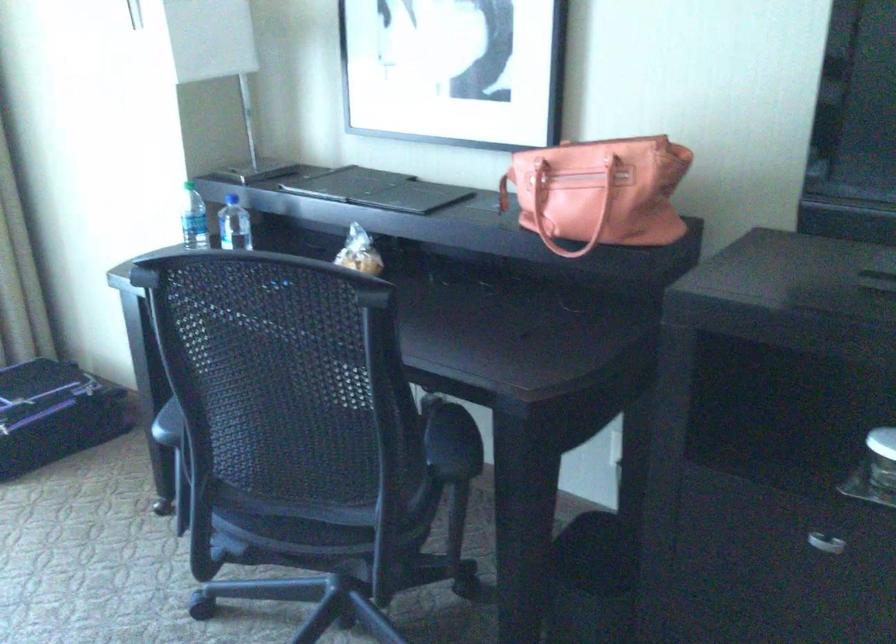
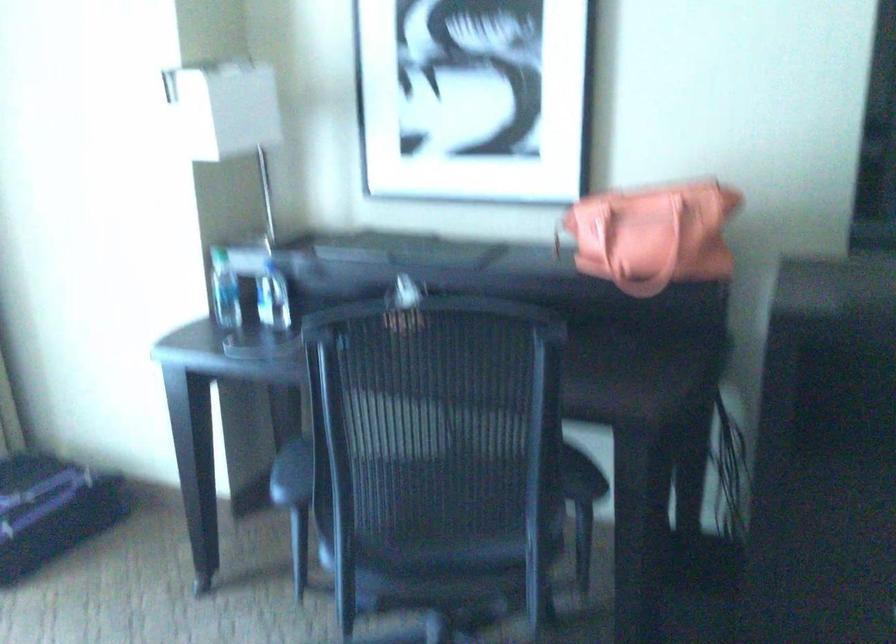
In the second image, find the point that corresponds to (x=320, y=502) in the first image.

(458, 544)